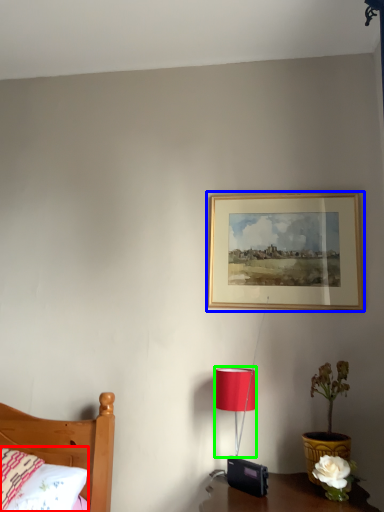
Question: Based on their relative distances, which object is farther from pillow (highlighted by a red box)? Choose from picture frame (highlighted by a blue box) and lamp (highlighted by a green box).

Choices:
 (A) picture frame
 (B) lamp

Answer: (A)